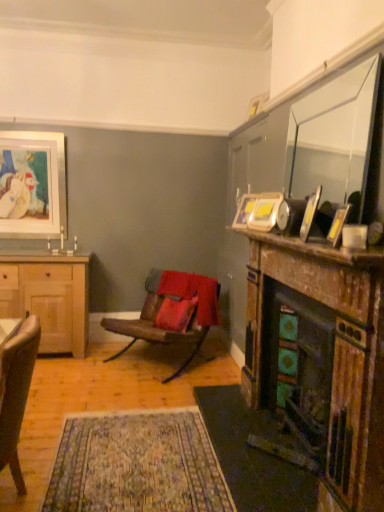
Question: Is yellow matte picture frame at upper right, acting as the first picture frame starting from the front, in front of or behind metallic gold picture frame at upper right, which is counted as the 2th picture frame, starting from the right, in the image?

Choices:
 (A) front
 (B) behind

Answer: (A)

Question: Considering the positions of yellow matte picture frame at upper right, acting as the first picture frame starting from the front, and metallic gold picture frame at upper right, which is the fourth picture frame in left-to-right order, in the image, is yellow matte picture frame at upper right, acting as the first picture frame starting from the front, wider or thinner than metallic gold picture frame at upper right, which is the fourth picture frame in left-to-right order,?

Choices:
 (A) wide
 (B) thin

Answer: (B)

Question: Considering the real-world distances, which object is farthest from the matte white picture frame at upper left, acting as the 1th picture frame starting from the back?

Choices:
 (A) light brown wooden cabinet at left
 (B) wooden fireplace at right
 (C) metallic silver picture frame at upper right, the third picture frame from the back
 (D) matte gold picture frame at upper center, placed as the second picture frame when sorted from back to front
 (E) velvet beige armchair at lower left, which is counted as the first chair, starting from the front

Answer: (B)

Question: Which is nearer to the matte gray corded phone at upper right?

Choices:
 (A) matte white picture frame at upper left, marked as the 5th picture frame in a right-to-left arrangement
 (B) wooden fireplace at right
 (C) wooden mantelpiece at right
 (D) metallic silver picture frame at upper right, the 3th picture frame viewed from the front
 (E) yellow matte picture frame at upper right, acting as the first picture frame starting from the front

Answer: (C)